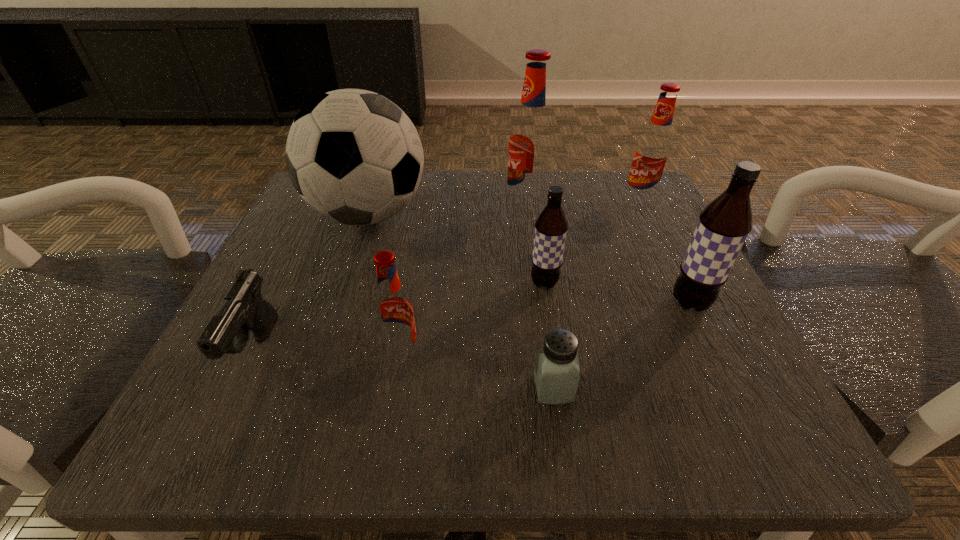
Identify the location of vacant area at the near left corner of the desktop. The width and height of the screenshot is (960, 540). (266, 395).

At what (x,y) coordinates should I click in order to perform the action: click on vacant point at the far right corner. Please return your answer as a coordinate pair (x, y). The width and height of the screenshot is (960, 540). Looking at the image, I should click on (617, 181).

Locate an element on the screen. vacant space at the near right corner is located at coordinates (673, 449).

Where is `blank region between the bigger brown root beer and the left brown root beer`? blank region between the bigger brown root beer and the left brown root beer is located at coordinates (617, 293).

The image size is (960, 540). What are the coordinates of `free area in between the black soccer ball and the second biggest red root beer` in the screenshot? It's located at (504, 208).

You are a GUI agent. You are given a task and a screenshot of the screen. Output one action in this format:
    pyautogui.click(x=<x>, y=<y>)
    Task: Click on the vacant region between the black pistol and the black soccer ball
    The image size is (960, 540).
    Given the screenshot: What is the action you would take?
    pyautogui.click(x=312, y=282)

At what (x,y) coordinates should I click in order to perform the action: click on free point between the biggest red root beer and the right brown root beer. Please return your answer as a coordinate pair (x, y). This screenshot has width=960, height=540. Looking at the image, I should click on (608, 256).

The image size is (960, 540). Find the location of `vacant area that lies between the bigger brown root beer and the black soccer ball`. vacant area that lies between the bigger brown root beer and the black soccer ball is located at coordinates (529, 259).

At what (x,y) coordinates should I click in order to perform the action: click on vacant space that's between the leftmost root beer and the smaller brown root beer. Please return your answer as a coordinate pair (x, y). Looking at the image, I should click on (473, 319).

Identify the location of vacant space that's between the second smallest red root beer and the saltshaker. (596, 295).